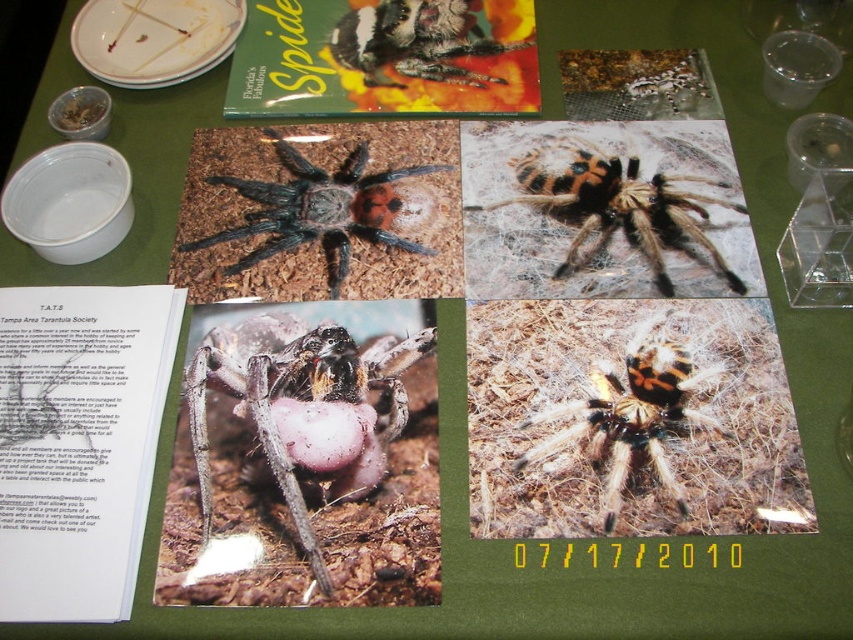
You are organizing a spider photography exhibit and need to ensure that the black and orange hairy tarantula at upper right and the matte gray spider at center are displayed in a way that highlights their size differences. According to the scene description, which spider should be placed in a larger frame to accurately represent their actual sizes?

The black and orange hairy tarantula at upper right should be placed in a larger frame because it has a larger size compared to the matte gray spider at center.

You are a researcher organizing a spider exhibit. You need to place a divider between the black fuzzy spider at center and the black and orange hairy tarantula at upper right to prevent them from touching. The divider you have is 5 inches wide. Will it fit between them?

The distance between the black fuzzy spider at center and the black and orange hairy tarantula at upper right is 5.47 inches. Since the divider is 5 inches wide, it will fit between them as there is enough space.